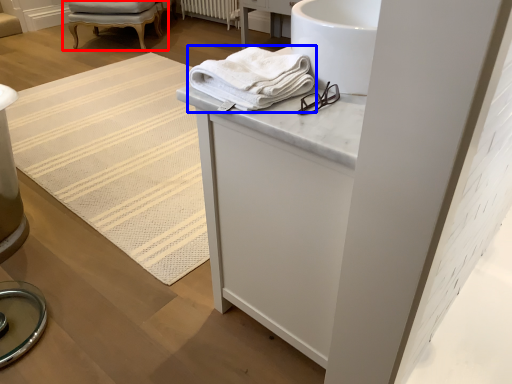
Question: Which object appears farthest to the camera in this image, chair (highlighted by a red box) or towel (highlighted by a blue box)?

Choices:
 (A) chair
 (B) towel

Answer: (A)